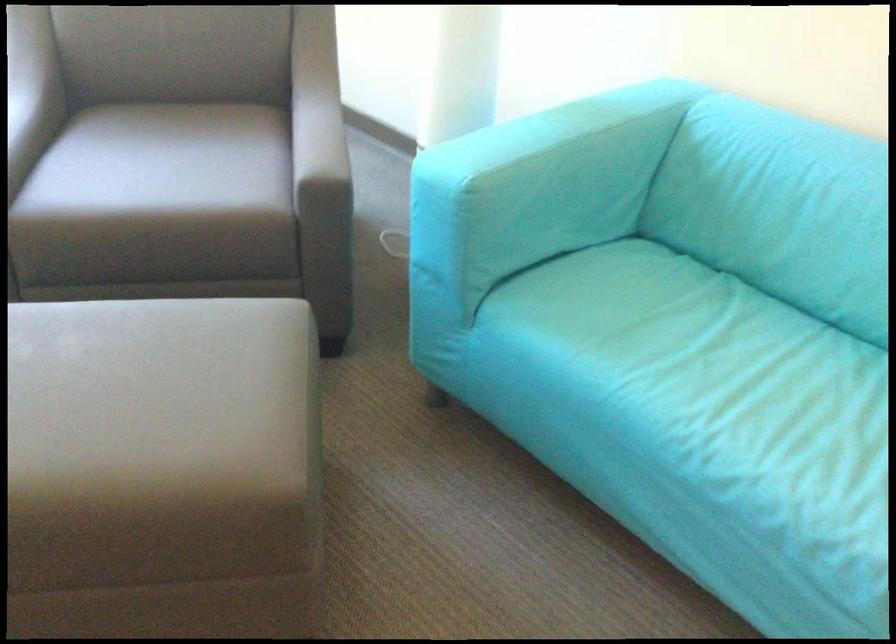
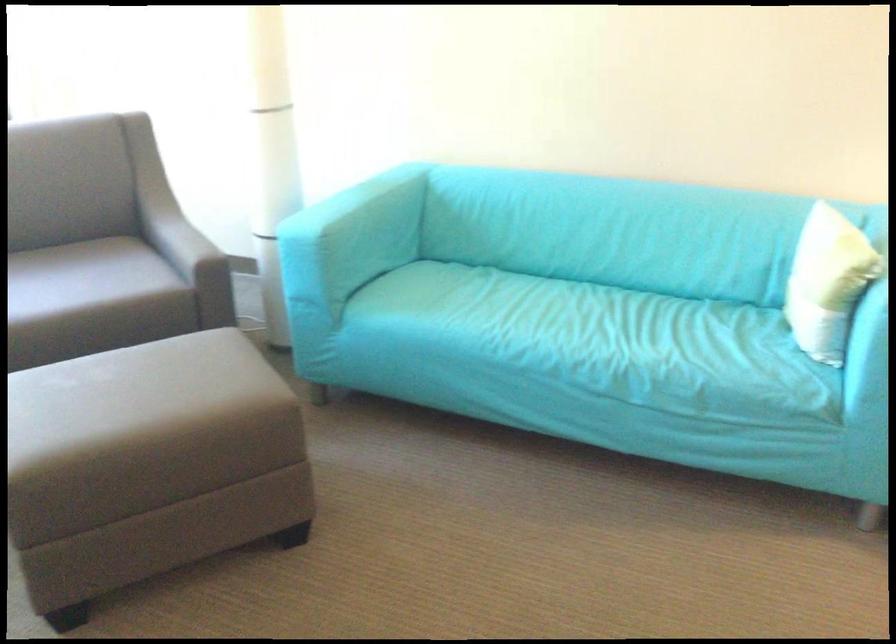
Where in the second image is the point corresponding to pixel 320 167 from the first image?

(188, 251)